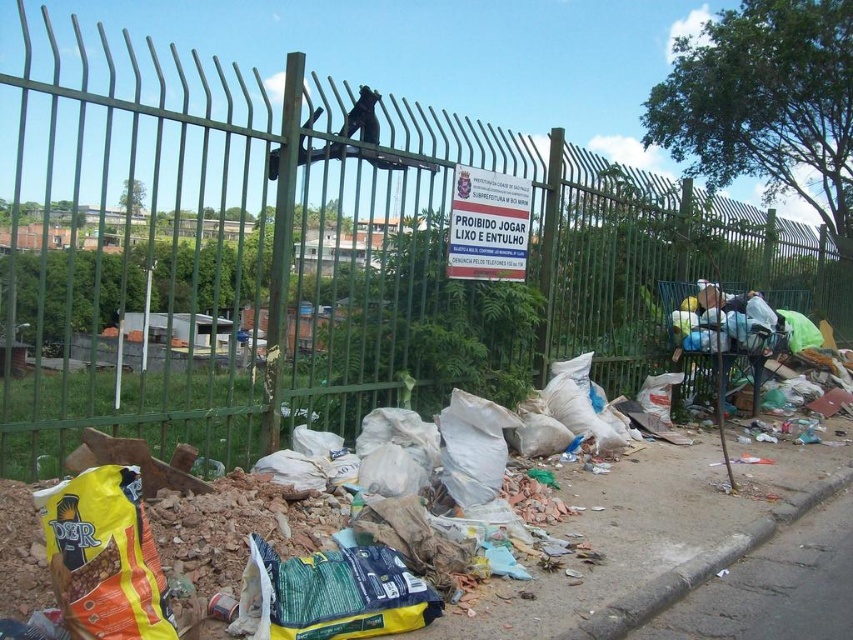
Where is `gray concrete pavement at lower right`? gray concrete pavement at lower right is located at coordinates (775, 588).

Is gray concrete pavement at lower right behind dark gray fabric bag at center right?

No, it is not.

Between point (848, 556) and point (746, 312), which one is positioned in front?

Positioned in front is point (848, 556).

Find the location of a particular element. The width and height of the screenshot is (853, 640). gray concrete pavement at lower right is located at coordinates (775, 588).